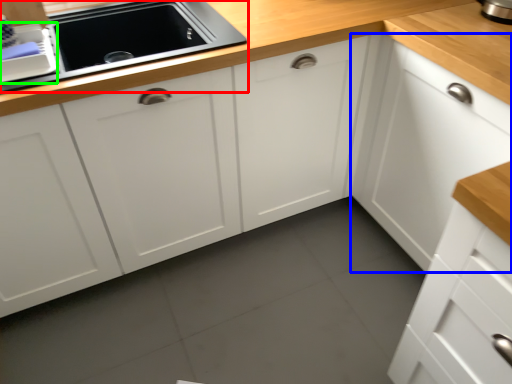
Question: Which is farther away from home appliance (highlighted by a red box)? cabinetry (highlighted by a blue box) or appliance (highlighted by a green box)?

Choices:
 (A) cabinetry
 (B) appliance

Answer: (A)